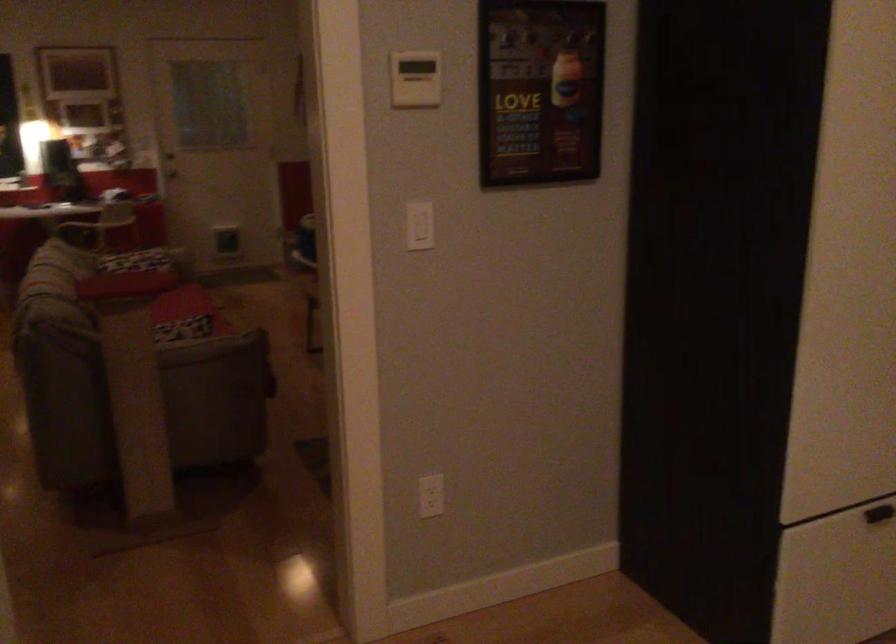
Locate an element on the screen. black cabinet handle is located at coordinates 879,514.